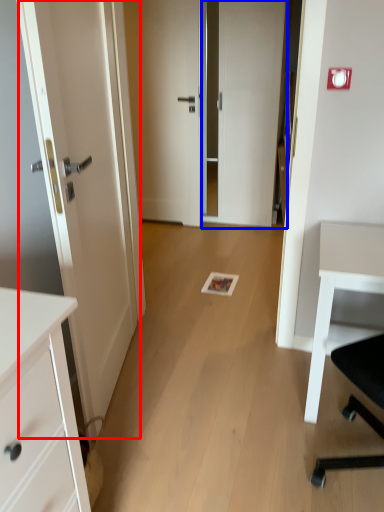
Question: Which point is further to the camera, door (highlighted by a red box) or door (highlighted by a blue box)?

Choices:
 (A) door
 (B) door

Answer: (B)